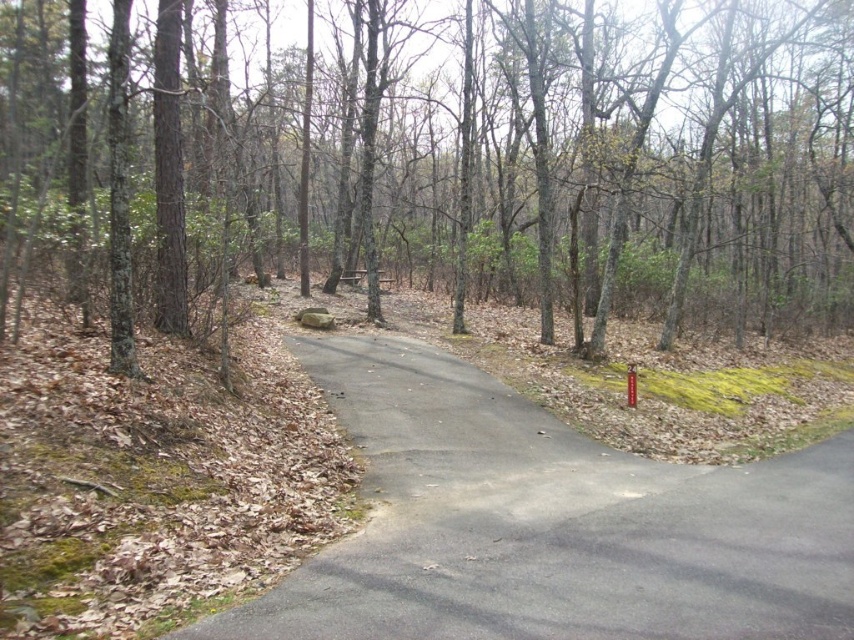
In the scene shown: You are standing at the starting point of the road. Which direction should you walk to reach the brown bark tree at center?

Since the brown bark tree at center is located at point coordinates of 0.250 on the x axis and 0.587 on the y axis, you should walk towards the center of the image to reach it.

You are a hiker standing at the brown bark tree at center. You see a cabin 30.91 feet away. Can you estimate how far you are from the cabin in meters?

The distance between the brown bark tree at center and the cabin is 30.91 feet, which converts to approximately 9.42 meters. Therefore, you are about 9.42 meters away from the cabin.

You are a hiker who wants to take a photo of the gray asphalt road at center from the position of the brown bark tree at center. Can you see the entire road clearly from there?

The gray asphalt road at center is behind brown bark tree at center, so you cannot see the entire road clearly from the position of the brown bark tree at center because the tree is blocking the view.